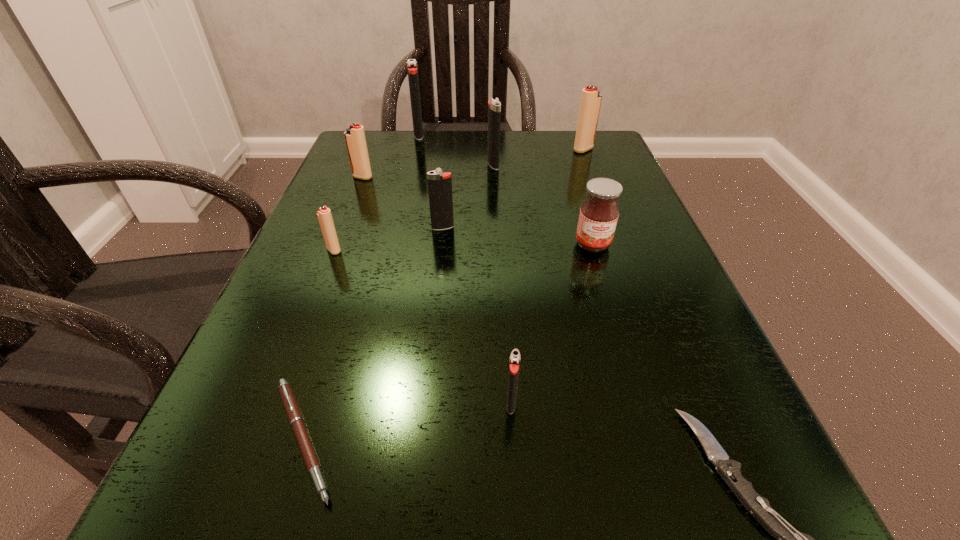
At what (x,y) coordinates should I click in order to perform the action: click on empty location between the jam and the smallest red igniter. Please return your answer as a coordinate pair (x, y). The width and height of the screenshot is (960, 540). Looking at the image, I should click on (464, 247).

Where is `blank region between the fifth object from left to right and the pink pen`? The image size is (960, 540). blank region between the fifth object from left to right and the pink pen is located at coordinates 372,333.

The width and height of the screenshot is (960, 540). I want to click on free area in between the third nearest black igniter and the biggest red igniter, so click(x=539, y=157).

Locate an element on the screen. blank region between the second biggest red igniter and the tallest object is located at coordinates (391, 156).

You are a GUI agent. You are given a task and a screenshot of the screen. Output one action in this format:
    pyautogui.click(x=<x>, y=<y>)
    Task: Click on the empty space that is in between the smallest red igniter and the tallest igniter
    The height and width of the screenshot is (540, 960).
    Given the screenshot: What is the action you would take?
    pyautogui.click(x=376, y=193)

I want to click on free spot between the leftmost black igniter and the pen, so (x=361, y=287).

Select which object appears as the fifth closest to the third biggest black igniter. Please provide its 2D coordinates. Your answer should be formatted as a tuple, i.e. [(x, y)], where the tuple contains the x and y coordinates of a point satisfying the conditions above.

[(296, 420)]

Locate which object ranks eighth in proximity to the sixth nearest igniter. Please provide its 2D coordinates. Your answer should be formatted as a tuple, i.e. [(x, y)], where the tuple contains the x and y coordinates of a point satisfying the conditions above.

[(788, 539)]

I want to click on igniter that is the fourth closest to the pocketknife, so click(x=494, y=111).

Select which igniter is the fourth closest to the pen. Please provide its 2D coordinates. Your answer should be formatted as a tuple, i.e. [(x, y)], where the tuple contains the x and y coordinates of a point satisfying the conditions above.

[(355, 139)]